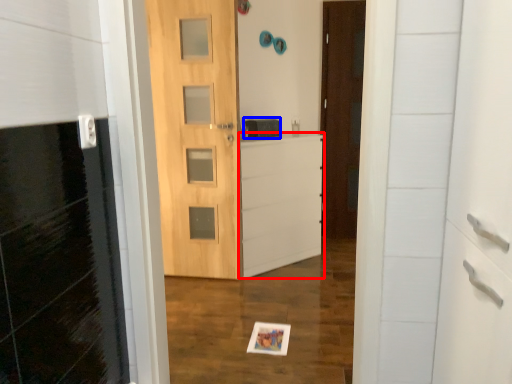
Question: Among these objects, which one is farthest to the camera, file cabinet (highlighted by a red box) or medicine cabinet (highlighted by a blue box)?

Choices:
 (A) file cabinet
 (B) medicine cabinet

Answer: (B)